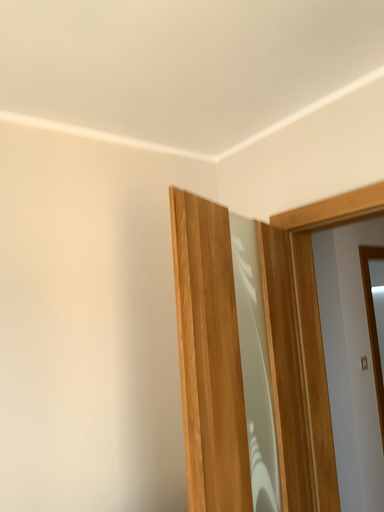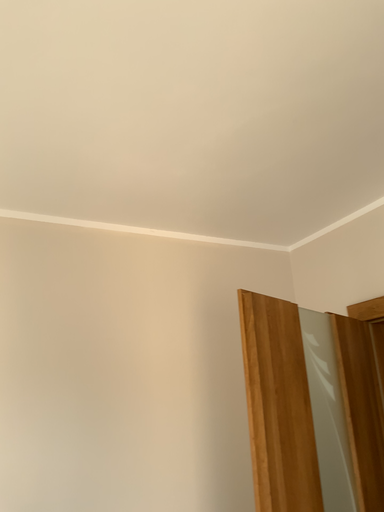
Question: How did the camera likely rotate when shooting the video?

Choices:
 (A) rotated right
 (B) rotated left

Answer: (B)